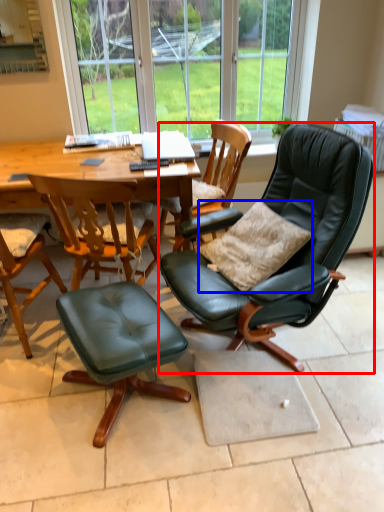
Question: Which of the following is the closest to the observer, chair (highlighted by a red box) or pillow (highlighted by a blue box)?

Choices:
 (A) chair
 (B) pillow

Answer: (A)